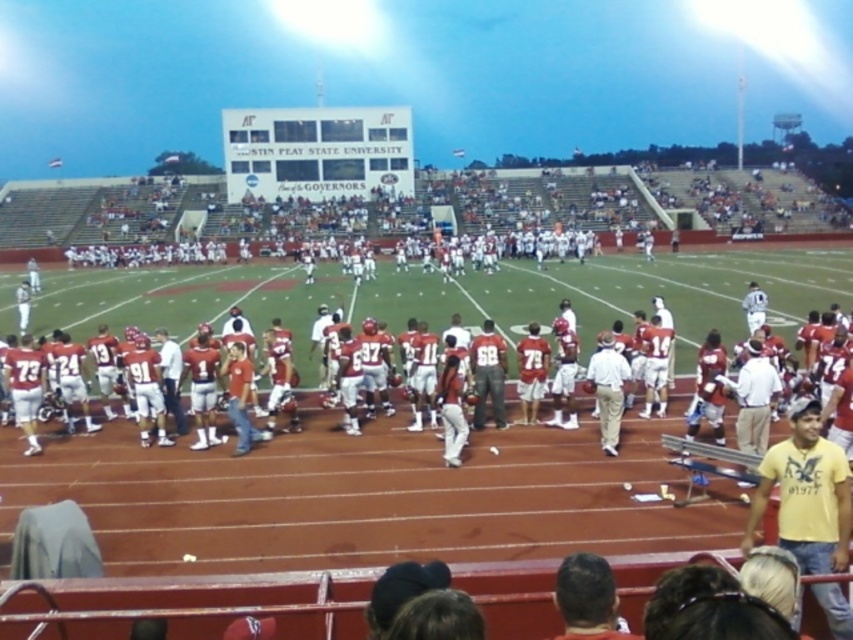
You are a coach standing at the center of the field during a pregame huddle. You notice two points marked on the field at coordinates point [790,416] and point [610,348]. Which point is closer to your current position?

Point [790,416] is in front of point [610,348], so it is closer to your current position at the center of the field.

You are a photographer at the football game and want to capture a photo of the yellow cotton shirt at lower right and matte gray pants at center. Which object should you focus on first to ensure both are in the frame?

The yellow cotton shirt at lower right is in front of matte gray pants at center, so you should focus on the yellow cotton shirt at lower right first to ensure both are in the frame.